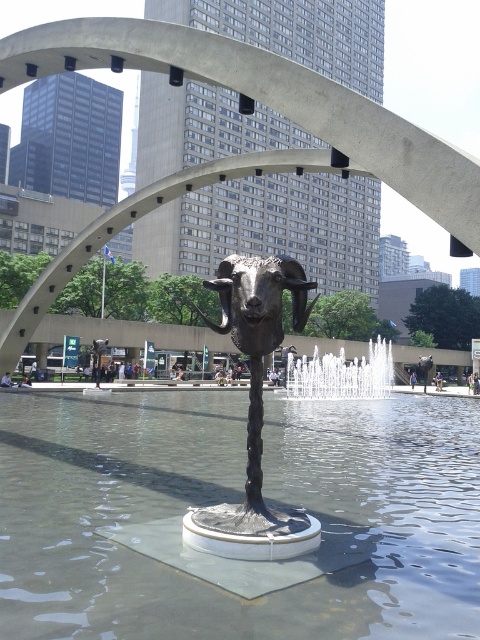
Is polished bronze ram at center below white frothy water at center?

No, polished bronze ram at center is not below white frothy water at center.

Can you confirm if polished bronze ram at center is smaller than white frothy water at center?

Yes, polished bronze ram at center is smaller than white frothy water at center.

Who is more forward, (224, 268) or (288, 355)?

Point (224, 268) is more forward.

Where is `polished bronze ram at center`? The image size is (480, 640). polished bronze ram at center is located at coordinates (259, 300).

Is the position of black polished metal ram at center more distant than that of polished bronze ram at center?

No, black polished metal ram at center is in front of polished bronze ram at center.

Which is below, black polished metal ram at center or polished bronze ram at center?

black polished metal ram at center is below.

Is point (229, 317) positioned after point (305, 301)?

No, it is not.

Locate an element on the screen. This screenshot has width=480, height=640. black polished metal ram at center is located at coordinates (254, 412).

Does clear glass water at center appear on the right side of black polished metal ram at center?

Incorrect, clear glass water at center is not on the right side of black polished metal ram at center.

Is clear glass water at center positioned behind black polished metal ram at center?

No, clear glass water at center is in front of black polished metal ram at center.

Is point (411, 483) positioned in front of point (235, 324)?

No, it is not.

Find the location of a particular element. The height and width of the screenshot is (640, 480). clear glass water at center is located at coordinates (235, 500).